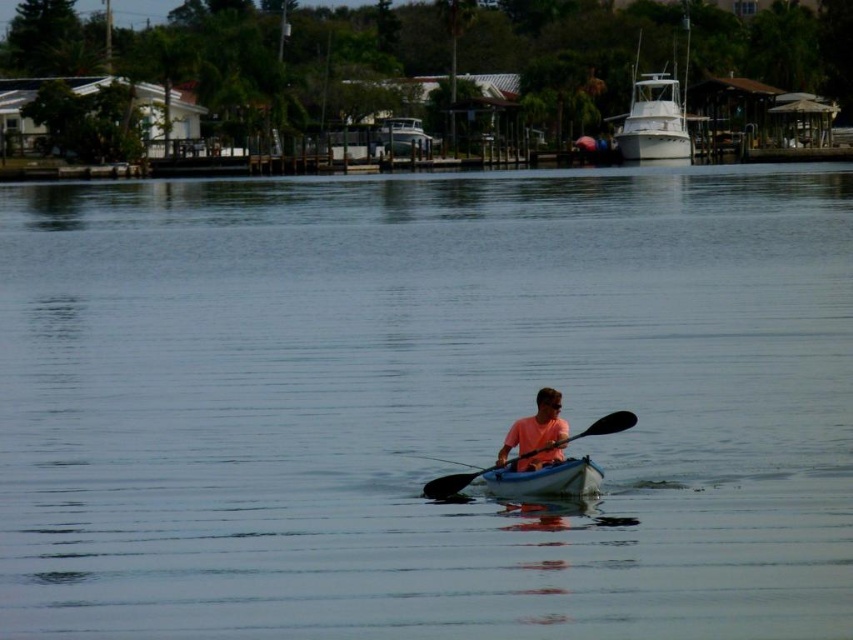
Does clear water at center have a smaller size compared to white glossy boat at upper center?

No.

Is clear water at center wider than white glossy boat at upper center?

Yes.

Where is `clear water at center`? clear water at center is located at coordinates (424, 403).

Identify the location of clear water at center. The image size is (853, 640). (424, 403).

This screenshot has height=640, width=853. I want to click on pink matte kayak at center, so click(x=537, y=426).

Does pink matte kayak at center come in front of black rubber paddle at center?

Yes, it is.

Describe the element at coordinates (537, 426) in the screenshot. I see `pink matte kayak at center` at that location.

Locate an element on the screen. pink matte kayak at center is located at coordinates (537, 426).

You are a GUI agent. You are given a task and a screenshot of the screen. Output one action in this format:
    pyautogui.click(x=<x>, y=<y>)
    Task: Click on the clear water at center
    
    Given the screenshot: What is the action you would take?
    pyautogui.click(x=424, y=403)

Can you confirm if clear water at center is wider than black rubber paddle at center?

Indeed, clear water at center has a greater width compared to black rubber paddle at center.

Which is behind, point (741, 166) or point (454, 474)?

Positioned behind is point (741, 166).

The height and width of the screenshot is (640, 853). I want to click on clear water at center, so click(424, 403).